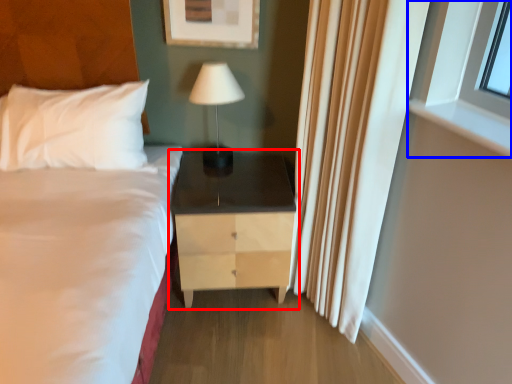
Question: Among these objects, which one is nearest to the camera, nightstand (highlighted by a red box) or window (highlighted by a blue box)?

Choices:
 (A) nightstand
 (B) window

Answer: (B)